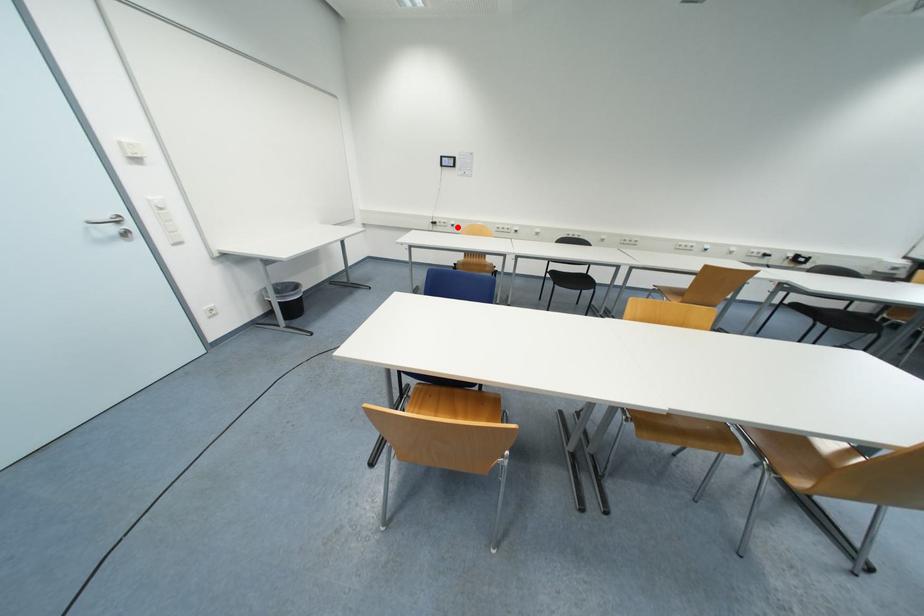
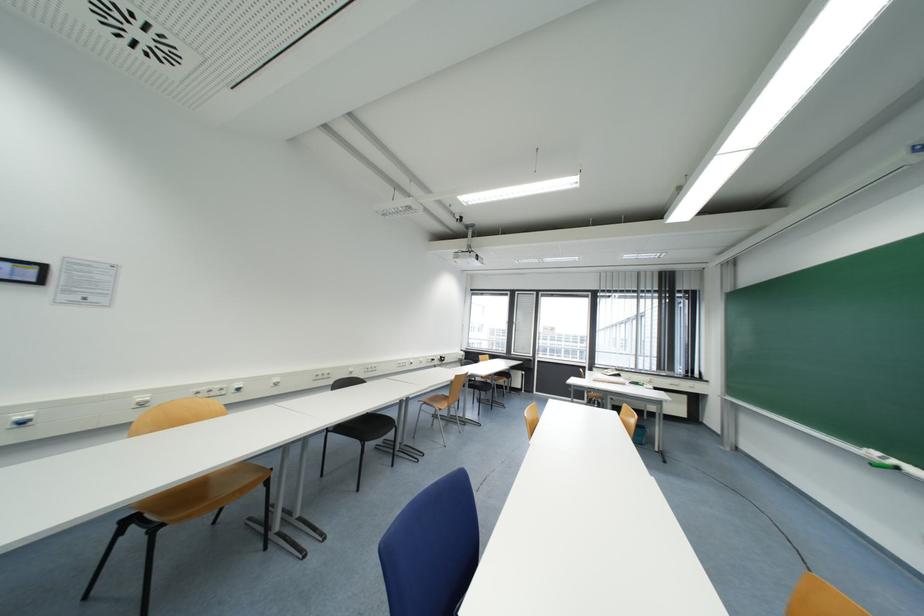
The point at the highlighted location is marked in the first image. Where is the corresponding point in the second image?

(28, 424)